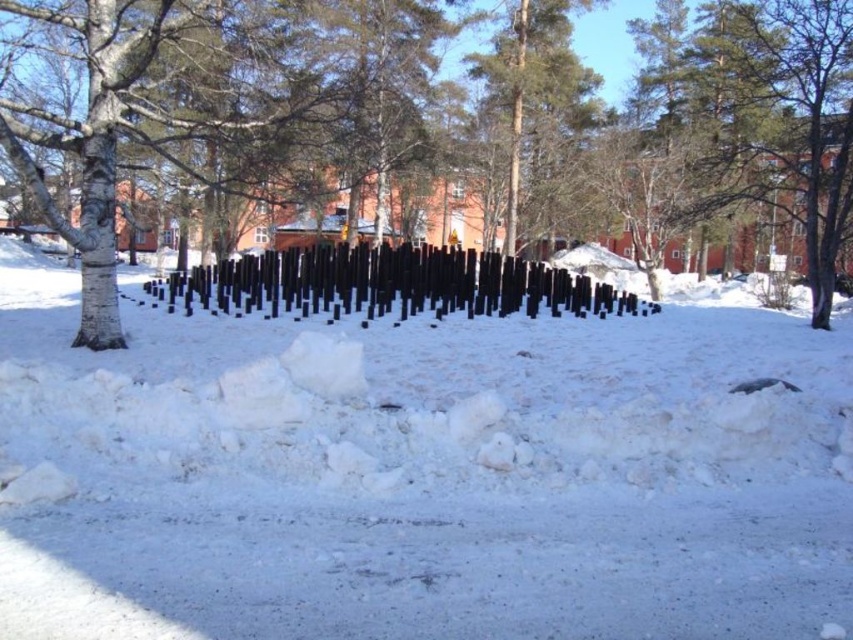
Does point (735, 632) lie behind point (834, 92)?

No.

Can you confirm if white fluffy snow at center is taller than bark textured tree at center?

No, white fluffy snow at center is not taller than bark textured tree at center.

Does point (503, 384) come in front of point (196, 113)?

Yes, it is in front of point (196, 113).

At what (x,y) coordinates should I click in order to perform the action: click on white fluffy snow at center. Please return your answer as a coordinate pair (x, y). Looking at the image, I should click on pyautogui.click(x=419, y=474).

Is white fluffy snow at center bigger than black polished wood posts at center?

No.

Does white fluffy snow at center appear on the right side of black polished wood posts at center?

Indeed, white fluffy snow at center is positioned on the right side of black polished wood posts at center.

Who is more forward, (229, 413) or (419, 301)?

Point (229, 413) is in front.

Locate an element on the screen. The height and width of the screenshot is (640, 853). white fluffy snow at center is located at coordinates (419, 474).

Between bark textured tree at center and black polished wood posts at center, which one appears on the left side from the viewer's perspective?

From the viewer's perspective, black polished wood posts at center appears more on the left side.

Where is `bark textured tree at center`? This screenshot has width=853, height=640. bark textured tree at center is located at coordinates (212, 106).